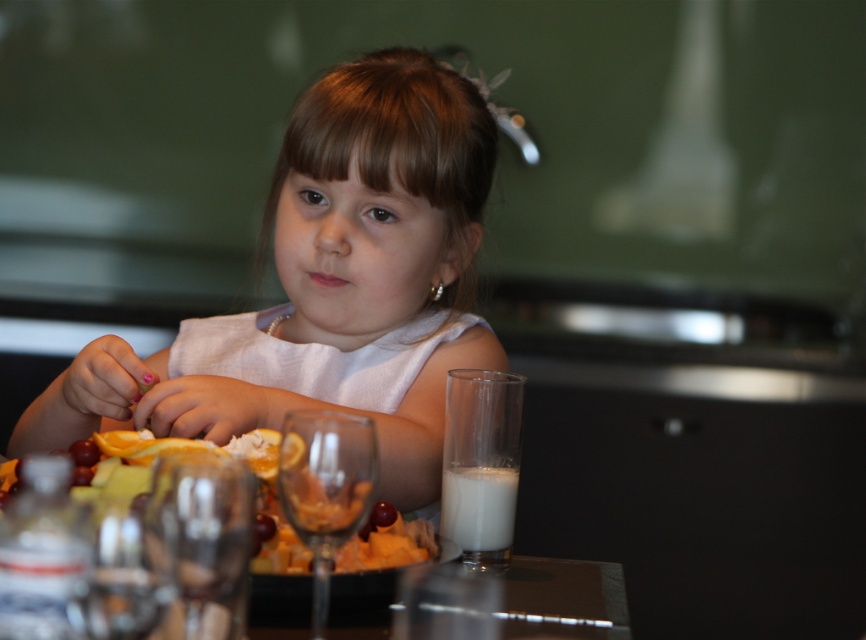
Is white fabric child at center bigger than glossy plastic fruit salad at lower left?

Yes.

Which is more to the right, white fabric child at center or glossy plastic fruit salad at lower left?

white fabric child at center

Who is more forward, (281, 253) or (391, 550)?

Point (391, 550)

The image size is (866, 640). In order to click on white fabric child at center in this screenshot , I will do `click(328, 285)`.

Between glossy plastic fruit salad at lower left and white opaque glass at lower right, which one is positioned lower?

white opaque glass at lower right is below.

At what (x,y) coordinates should I click in order to perform the action: click on glossy plastic fruit salad at lower left. Please return your answer as a coordinate pair (x, y). Looking at the image, I should click on (196, 449).

Between point (359, 362) and point (503, 470), which one is positioned behind?

Point (359, 362)

Between white fabric child at center and white opaque glass at lower right, which one is positioned higher?

white fabric child at center

Who is more distant from viewer, (380, 156) or (459, 536)?

The point (380, 156) is more distant.

I want to click on white fabric child at center, so click(x=328, y=285).